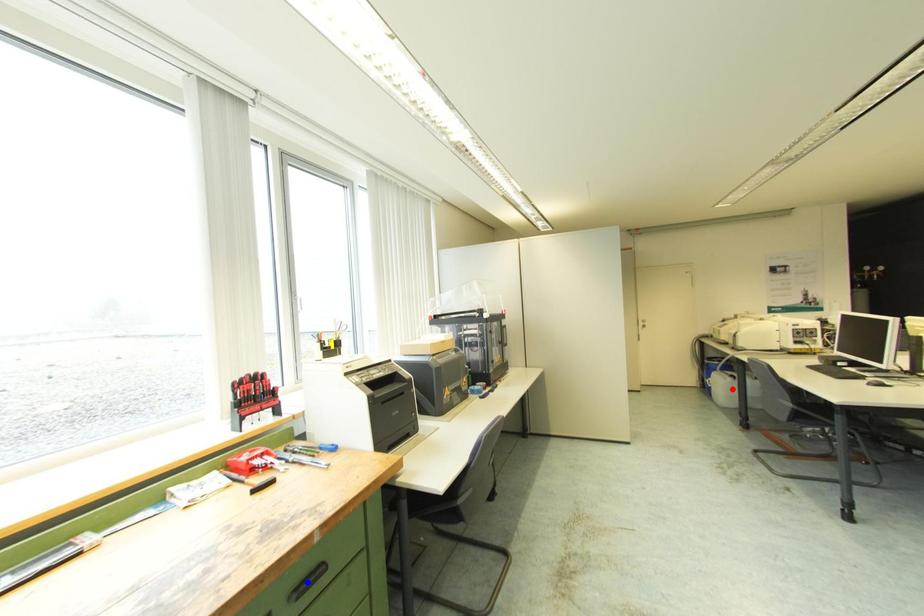
Question: Two points are marked on the image. Which point is closer to the camera?

Choices:
 (A) Blue point is closer.
 (B) Red point is closer.

Answer: (A)